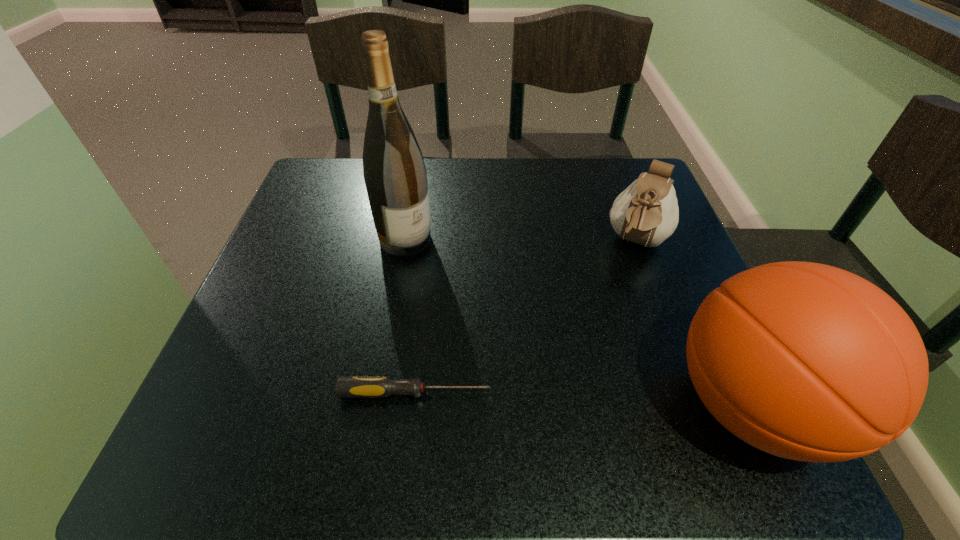
Locate an element on the screen. object that is the second nearest to the screwdriver is located at coordinates [x=394, y=172].

The image size is (960, 540). I want to click on vacant space that satisfies the following two spatial constraints: 1. on the front side of the tallest object; 2. on the left side of the second tallest object, so click(375, 406).

Where is `free region that satisfies the following two spatial constraints: 1. on the front side of the tallest object; 2. insert the shortest object into a screw head`? This screenshot has height=540, width=960. free region that satisfies the following two spatial constraints: 1. on the front side of the tallest object; 2. insert the shortest object into a screw head is located at coordinates (378, 393).

Find the location of a particular element. vacant space that satisfies the following two spatial constraints: 1. on the front side of the screwdriver; 2. insert the wine bottle into a screw head is located at coordinates (x=378, y=393).